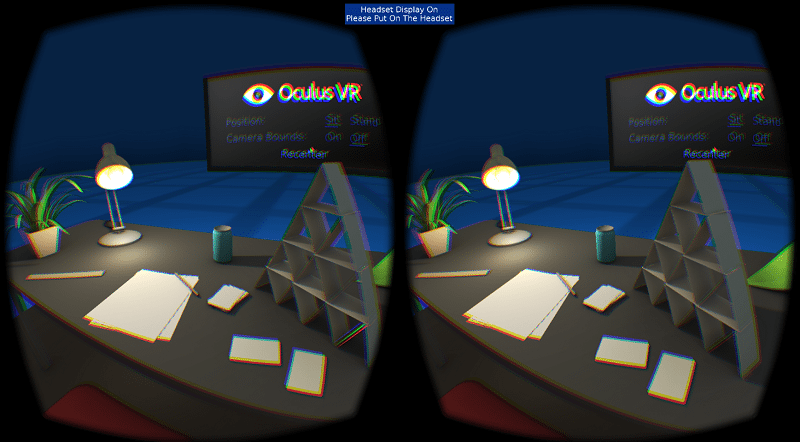
What are the coordinates of `vase` in the screenshot? It's located at (37, 236).